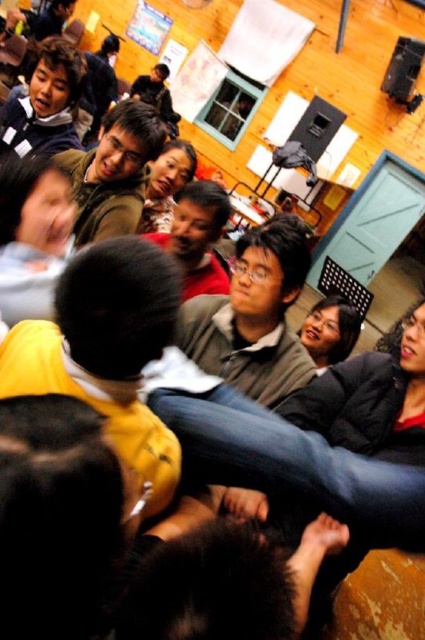
You are organizing a charity event and need to decide which item to display first between the matte brown sweater at center and the matte brown jacket at upper center. Based on their thickness, which one should you choose if you want the thinner item?

The matte brown sweater at center is thinner than the matte brown jacket at upper center, so you should choose the matte brown sweater at center.

You are organizing a small event and need to know which item takes up more space to arrange seating properly. Which occupies more space between the matte brown sweater at center and the matte brown jacket at upper center?

The matte brown jacket at upper center occupies more space than the matte brown sweater at center.